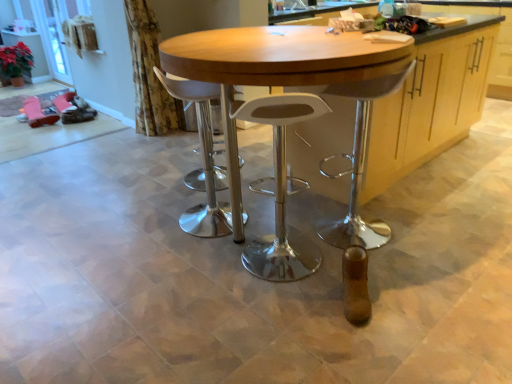
At what (x,y) coordinates should I click in order to perform the action: click on vacant area that lies to the right of wooden table at center. Please return your answer as a coordinate pair (x, y). The image size is (512, 384). Looking at the image, I should click on (449, 226).